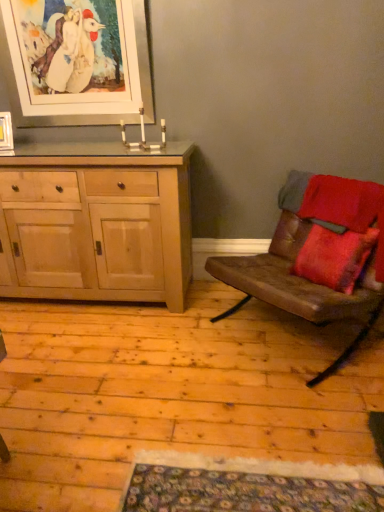
Question: Is white matte picture frame at upper left, which ranks as the 1th picture frame in top-to-bottom order, a part of brown leather couch at right?

Choices:
 (A) yes
 (B) no

Answer: (B)

Question: Is brown leather couch at right oriented towards white matte picture frame at upper left, which ranks as the 1th picture frame in top-to-bottom order?

Choices:
 (A) yes
 (B) no

Answer: (B)

Question: From the image's perspective, is brown leather couch at right on white matte picture frame at upper left, which appears as the 1th picture frame when viewed from the right?

Choices:
 (A) yes
 (B) no

Answer: (B)

Question: Can we say brown leather couch at right lies outside white matte picture frame at upper left, positioned as the second picture frame in bottom-to-top order?

Choices:
 (A) no
 (B) yes

Answer: (B)

Question: Considering the relative sizes of brown leather couch at right and white matte picture frame at upper left, which ranks as the 1th picture frame in top-to-bottom order, in the image provided, is brown leather couch at right shorter than white matte picture frame at upper left, which ranks as the 1th picture frame in top-to-bottom order,?

Choices:
 (A) no
 (B) yes

Answer: (A)

Question: Is matte wooden picture frame at upper left, positioned as the 2th picture frame in top-to-bottom order, inside or outside of brown leather couch at right?

Choices:
 (A) outside
 (B) inside

Answer: (A)

Question: Looking at their shapes, would you say matte wooden picture frame at upper left, positioned as the first picture frame in bottom-to-top order, is wider or thinner than brown leather couch at right?

Choices:
 (A) wide
 (B) thin

Answer: (B)

Question: From a real-world perspective, is matte wooden picture frame at upper left, the 2th picture frame positioned from the right, physically located above or below brown leather couch at right?

Choices:
 (A) above
 (B) below

Answer: (A)

Question: From the image's perspective, relative to brown leather couch at right, is matte wooden picture frame at upper left, positioned as the 2th picture frame in top-to-bottom order, above or below?

Choices:
 (A) below
 (B) above

Answer: (B)

Question: Looking at their shapes, would you say white matte picture frame at upper left, which ranks as the 1th picture frame in top-to-bottom order, is wider or thinner than natural wood cabinet at left?

Choices:
 (A) thin
 (B) wide

Answer: (A)

Question: From the image's perspective, is white matte picture frame at upper left, positioned as the second picture frame in bottom-to-top order, located above or below natural wood cabinet at left?

Choices:
 (A) below
 (B) above

Answer: (B)

Question: From a real-world perspective, is white matte picture frame at upper left, positioned as the second picture frame in bottom-to-top order, positioned above or below natural wood cabinet at left?

Choices:
 (A) above
 (B) below

Answer: (A)

Question: Is point (152, 101) positioned closer to the camera than point (109, 245)?

Choices:
 (A) farther
 (B) closer

Answer: (A)

Question: Is point (365, 332) closer or farther from the camera than point (162, 174)?

Choices:
 (A) closer
 (B) farther

Answer: (B)

Question: Based on their sizes in the image, would you say brown leather couch at right is bigger or smaller than natural wood cabinet at left?

Choices:
 (A) big
 (B) small

Answer: (B)